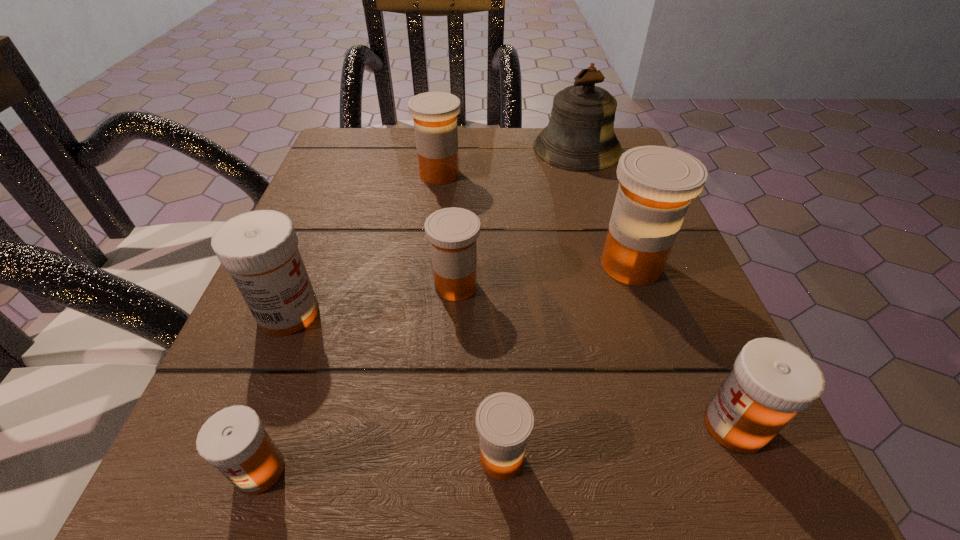
Locate an element on the screen. The image size is (960, 540). vacant space at the left edge of the desktop is located at coordinates (315, 202).

In the image, there is a desktop. Find the location of `vacant space at the right edge`. vacant space at the right edge is located at coordinates tap(583, 204).

Find the location of a particular element. vacant space at the far left corner of the desktop is located at coordinates (404, 131).

What are the coordinates of `vacant position at the near left corner of the desktop` in the screenshot? It's located at (215, 499).

The image size is (960, 540). I want to click on vacant position at the near right corner of the desktop, so click(723, 489).

The width and height of the screenshot is (960, 540). I want to click on vacant area between the farthest orange medicine and the second biggest white medicine, so click(x=587, y=300).

Identify the location of free space between the farthest white medicine and the third biggest orange medicine. (372, 299).

Locate an element on the screen. empty space that is in between the bell and the nearest orange medicine is located at coordinates (540, 303).

Identify the location of vacant space in between the biggest orange medicine and the bell. (604, 207).

This screenshot has height=540, width=960. Find the location of `vacant area between the farthest orange medicine and the farthest white medicine`. vacant area between the farthest orange medicine and the farthest white medicine is located at coordinates (364, 244).